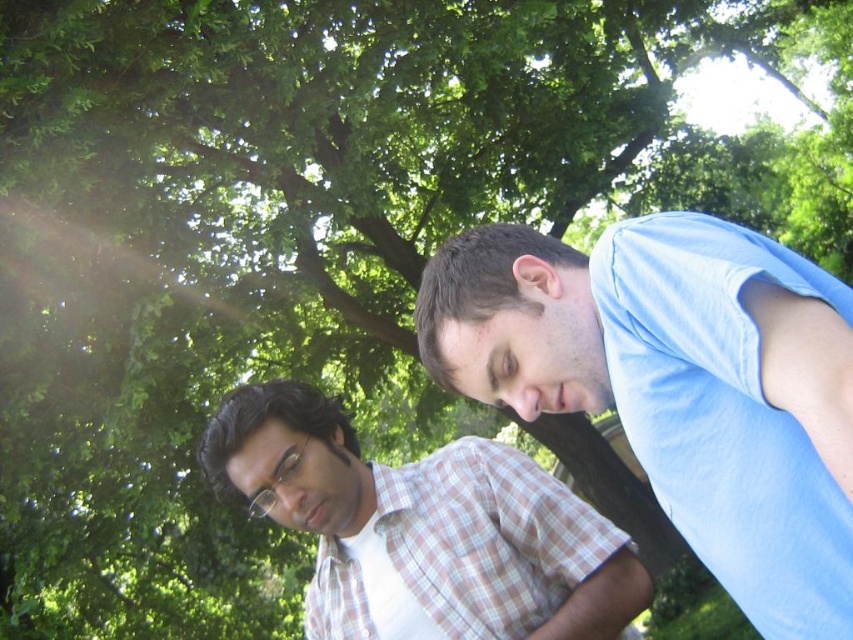
Question: Which point appears farthest from the camera in this image?

Choices:
 (A) (480, 353)
 (B) (346, 554)

Answer: (B)

Question: Which of the following is the closest to the observer?

Choices:
 (A) white checkered shirt at center
 (B) light blue cotton shirt at right

Answer: (B)

Question: Does light blue cotton shirt at right appear over white checkered shirt at center?

Choices:
 (A) yes
 (B) no

Answer: (A)

Question: Can you confirm if light blue cotton shirt at right is positioned to the left of white checkered shirt at center?

Choices:
 (A) no
 (B) yes

Answer: (A)

Question: Is light blue cotton shirt at right to the left of white checkered shirt at center from the viewer's perspective?

Choices:
 (A) yes
 (B) no

Answer: (B)